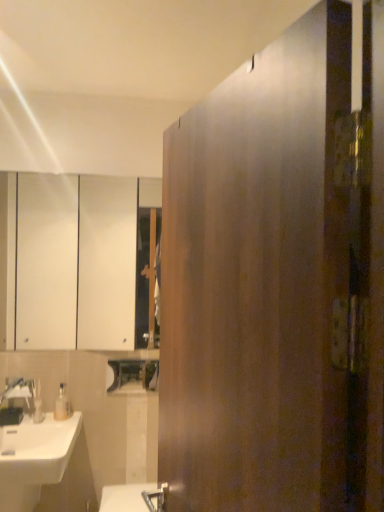
Find the location of a particular element. Image resolution: width=384 pixels, height=512 pixels. matte plastic soap dispenser at lower left is located at coordinates (38, 404).

This screenshot has height=512, width=384. Describe the element at coordinates (38, 404) in the screenshot. I see `matte plastic soap dispenser at lower left` at that location.

Where is `brushed metal faucet at lower left`? This screenshot has height=512, width=384. brushed metal faucet at lower left is located at coordinates (16, 401).

Measure the distance between brushed metal faucet at lower left and camera.

The distance of brushed metal faucet at lower left from camera is 2.07 meters.

What is the approximate width of white glossy cabinet at upper left?

The width of white glossy cabinet at upper left is 2.45 inches.

What do you see at coordinates (62, 404) in the screenshot? I see `translucent plastic soap dispenser at lower left` at bounding box center [62, 404].

Describe the element at coordinates (34, 458) in the screenshot. The width and height of the screenshot is (384, 512). I see `white glossy sink at lower left` at that location.

Describe the element at coordinates (277, 281) in the screenshot. I see `satin wood door at center` at that location.

Find the location of a particular element. matte plastic soap dispenser at lower left is located at coordinates (38, 404).

How much distance is there between matte plastic soap dispenser at lower left and white glossy sink at lower left?

9.34 inches.

From a real-world perspective, is matte plastic soap dispenser at lower left located beneath white glossy sink at lower left?

No, from a real-world perspective, matte plastic soap dispenser at lower left is not under white glossy sink at lower left.

Between matte plastic soap dispenser at lower left and white glossy sink at lower left, which one has smaller size?

matte plastic soap dispenser at lower left is smaller.

From the image's perspective, which object appears higher, matte plastic soap dispenser at lower left or white glossy sink at lower left?

matte plastic soap dispenser at lower left, from the image's perspective.

Identify the location of door in front of the translucent plastic soap dispenser at lower left. The height and width of the screenshot is (512, 384). (277, 281).

From the image's perspective, is satin wood door at center above translucent plastic soap dispenser at lower left?

Yes.

Can you tell me how much satin wood door at center and translucent plastic soap dispenser at lower left differ in facing direction?

74.6 degrees separate the facing orientations of satin wood door at center and translucent plastic soap dispenser at lower left.

Is satin wood door at center facing away from translucent plastic soap dispenser at lower left?

No, satin wood door at center's orientation is not away from translucent plastic soap dispenser at lower left.

Does white glossy sink at lower left turn towards satin wood door at center?

No, white glossy sink at lower left does not turn towards satin wood door at center.

Who is taller, white glossy sink at lower left or satin wood door at center?

Standing taller between the two is satin wood door at center.

Which of these two, white glossy sink at lower left or satin wood door at center, is smaller?

With smaller size is white glossy sink at lower left.

Does satin wood door at center have a lesser width compared to matte plastic soap dispenser at lower left?

No, satin wood door at center is not thinner than matte plastic soap dispenser at lower left.

Which point is more forward, [181,502] or [42,420]?

Point [181,502]

How much distance is there between satin wood door at center and matte plastic soap dispenser at lower left?

satin wood door at center is 5.71 feet from matte plastic soap dispenser at lower left.

Is translucent plastic soap dispenser at lower left thinner than matte plastic soap dispenser at lower left?

No, translucent plastic soap dispenser at lower left is not thinner than matte plastic soap dispenser at lower left.

Does translucent plastic soap dispenser at lower left appear on the right side of matte plastic soap dispenser at lower left?

Yes, translucent plastic soap dispenser at lower left is to the right of matte plastic soap dispenser at lower left.

The height and width of the screenshot is (512, 384). I want to click on soap dispenser below the matte plastic soap dispenser at lower left (from a real-world perspective), so click(62, 404).

Is white glossy cabinet at upper left oriented away from white glossy sink at lower left?

white glossy cabinet at upper left is not turned away from white glossy sink at lower left.

Which point is more distant from viewer, (67, 287) or (24, 426)?

The point (67, 287) is more distant.

Is white glossy cabinet at upper left far away from white glossy sink at lower left?

Yes, white glossy cabinet at upper left and white glossy sink at lower left are quite far apart.

Considering the positions of objects white glossy cabinet at upper left and white glossy sink at lower left in the image provided, who is more to the right, white glossy cabinet at upper left or white glossy sink at lower left?

Positioned to the right is white glossy cabinet at upper left.

Is white glossy cabinet at upper left touching brushed metal faucet at lower left?

There is a gap between white glossy cabinet at upper left and brushed metal faucet at lower left.

Is white glossy cabinet at upper left oriented towards brushed metal faucet at lower left?

No, white glossy cabinet at upper left is not turned towards brushed metal faucet at lower left.

Which is correct: white glossy cabinet at upper left is inside brushed metal faucet at lower left, or outside of it?

white glossy cabinet at upper left is located beyond the bounds of brushed metal faucet at lower left.

I want to click on toiletry behind the white glossy sink at lower left, so click(38, 404).

The height and width of the screenshot is (512, 384). There is a translucent plastic soap dispenser at lower left. Identify the location of door above it (from a real-world perspective). (277, 281).

From the image, which object appears to be nearer to translucent plastic soap dispenser at lower left, white glossy sink at lower left or white glossy cabinet at upper left?

Among the two, white glossy sink at lower left is located nearer to translucent plastic soap dispenser at lower left.

Based on their spatial positions, is white glossy sink at lower left or satin wood door at center further from translucent plastic soap dispenser at lower left?

Based on the image, satin wood door at center appears to be further to translucent plastic soap dispenser at lower left.

Looking at the image, which one is located further to white glossy sink at lower left, white glossy cabinet at upper left or matte plastic soap dispenser at lower left?

white glossy cabinet at upper left is positioned further to the anchor white glossy sink at lower left.

In the scene shown: Which object lies nearer to the anchor point brushed metal faucet at lower left, white glossy sink at lower left or matte plastic soap dispenser at lower left?

matte plastic soap dispenser at lower left lies closer to brushed metal faucet at lower left than the other object.

From the image, which object appears to be nearer to translucent plastic soap dispenser at lower left, satin wood door at center or white glossy cabinet at upper left?

Among the two, satin wood door at center is located nearer to translucent plastic soap dispenser at lower left.

When comparing their distances from matte plastic soap dispenser at lower left, does white glossy cabinet at upper left or satin wood door at center seem closer?

satin wood door at center lies closer to matte plastic soap dispenser at lower left than the other object.

From the image, which object appears to be nearer to satin wood door at center, white glossy sink at lower left or brushed metal faucet at lower left?

Among the two, white glossy sink at lower left is located nearer to satin wood door at center.

Based on the photo, from the image, which object appears to be farther from white glossy sink at lower left, brushed metal faucet at lower left or satin wood door at center?

Based on the image, satin wood door at center appears to be further to white glossy sink at lower left.

At what (x,y) coordinates should I click in order to perform the action: click on sink located between satin wood door at center and matte plastic soap dispenser at lower left in the depth direction. Please return your answer as a coordinate pair (x, y). Looking at the image, I should click on 34,458.

The height and width of the screenshot is (512, 384). What are the coordinates of `tap between satin wood door at center and white glossy cabinet at upper left in the front-back direction` in the screenshot? It's located at (16, 401).

This screenshot has height=512, width=384. What are the coordinates of `tap between white glossy sink at lower left and translucent plastic soap dispenser at lower left along the z-axis` in the screenshot? It's located at (16, 401).

The width and height of the screenshot is (384, 512). What are the coordinates of `tap located between satin wood door at center and translucent plastic soap dispenser at lower left in the depth direction` in the screenshot? It's located at (16, 401).